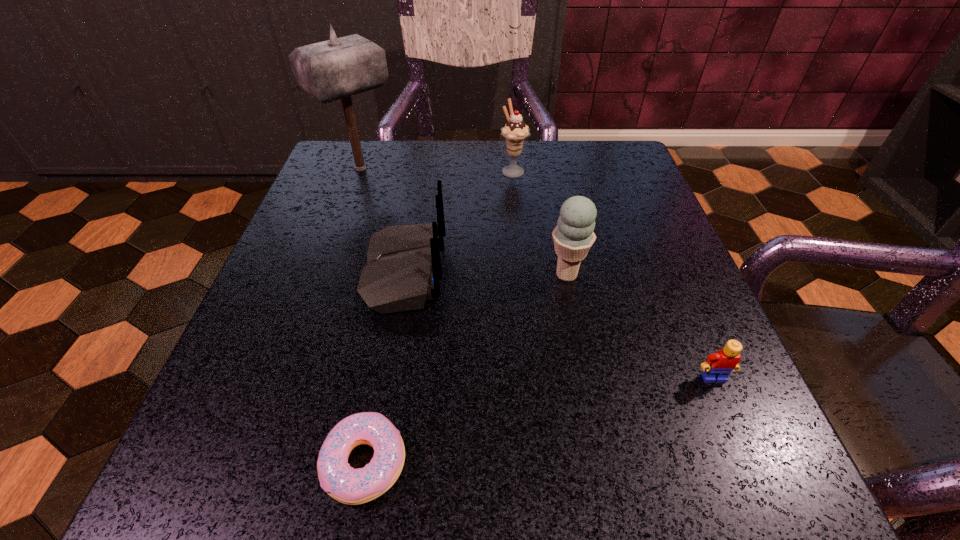
Identify the location of vacant space in between the third object from right to left and the nearer ice cream. (540, 222).

The width and height of the screenshot is (960, 540). What are the coordinates of `empty location between the nearer ice cream and the second shortest object` in the screenshot? It's located at (640, 326).

Find the location of a particular element. blank region between the Lego and the shortest object is located at coordinates (539, 420).

In order to click on vacant area between the router and the third object from right to left in this screenshot , I will do click(x=459, y=221).

Locate an element on the screen. vacant space that's between the right ice cream and the doughnut is located at coordinates pyautogui.click(x=466, y=369).

Locate an element on the screen. The image size is (960, 540). vacant region between the mallet and the router is located at coordinates (383, 220).

Locate an element on the screen. The image size is (960, 540). vacant point located between the router and the nearest object is located at coordinates (384, 367).

Find the location of a particular element. Image resolution: width=960 pixels, height=540 pixels. empty location between the router and the left ice cream is located at coordinates (459, 221).

You are a GUI agent. You are given a task and a screenshot of the screen. Output one action in this format:
    pyautogui.click(x=<x>, y=<y>)
    Task: Click on the vacant space in between the right ice cream and the mallet
    This screenshot has width=960, height=540.
    Given the screenshot: What is the action you would take?
    pyautogui.click(x=464, y=221)

I want to click on free point between the second object from right to left and the tallest object, so click(x=464, y=221).